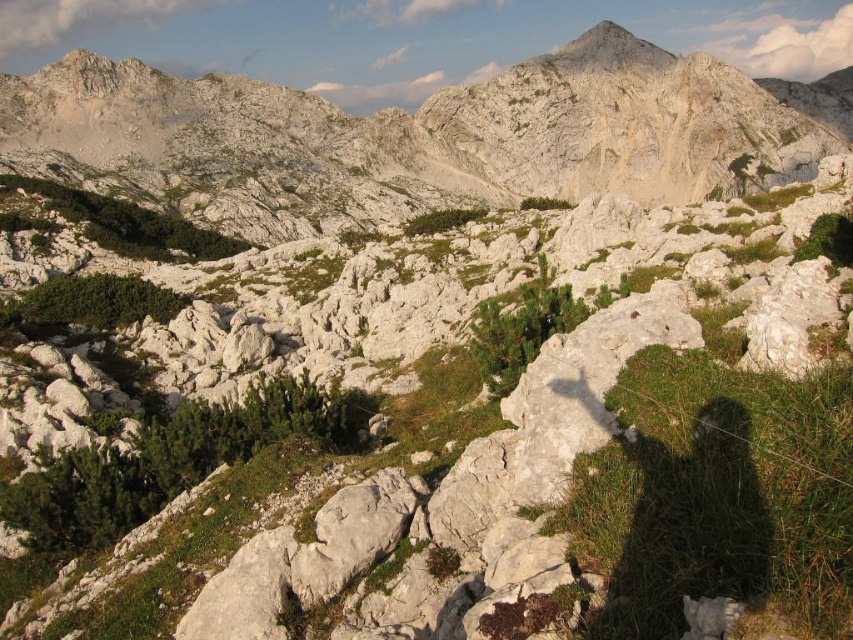
You are a hiker standing at the base of the white rocky mountain at center. You see a trail that leads to a viewpoint 55.07 meters away. If your hiking boots have a grip rating of 7 out of 10, and the trail has a slip resistance rating of 6 out of 10, will you be able to safely reach the viewpoint?

The white rocky mountain at center has a viewpoint 55.07 meters away. Since your hiking boots have a grip rating of 7 and the trail has a slip resistance rating of 6, the combined safety margin is sufficient. Therefore, you can safely reach the viewpoint.

You are a hiker planning to climb both the white rocky mountain at center and the smooth gray rock peak at upper center. Based on their positions, which one should you climb first to follow a logical climbing path?

You should climb the white rocky mountain at center first because it is positioned below the smooth gray rock peak at upper center, suggesting it is a lower elevation and a natural starting point for the climb.

You are planning a hiking route and need to know which mountain is higher. Based on the image, which is taller between the white rocky mountain at center and the smooth gray rock peak at upper center?

The white rocky mountain at center is taller than the smooth gray rock peak at upper center according to the description.